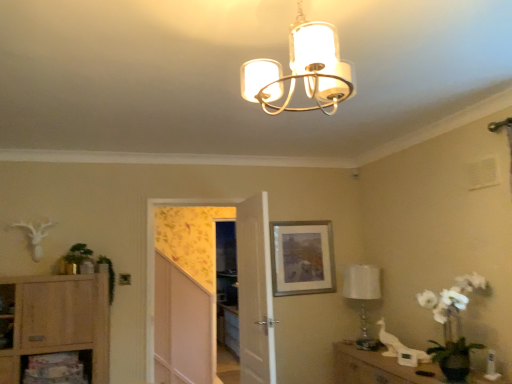
Locate an element on the screen. Image resolution: width=512 pixels, height=384 pixels. white matte chandelier at upper center, which is the 1th lamp from front to back is located at coordinates (302, 70).

At what (x,y) coordinates should I click in order to perform the action: click on transparent glass screen door at center. Please return your answer as a coordinate pair (x, y). This screenshot has height=384, width=512. Looking at the image, I should click on (239, 278).

The width and height of the screenshot is (512, 384). What are the coordinates of `green leafy plant at left, the 2th plant in the left-to-right sequence` in the screenshot? It's located at (108, 273).

Where is `green leafy plant at left, the second plant from the right`? green leafy plant at left, the second plant from the right is located at coordinates (78, 254).

The width and height of the screenshot is (512, 384). I want to click on wooden cabinet at lower right, so (x=377, y=368).

Considering the points (97, 258) and (353, 78), which point is behind, point (97, 258) or point (353, 78)?

The point (97, 258) is more distant.

Is the depth of green leafy plant at left, marked as the first plant in a right-to-left arrangement, greater than that of white matte chandelier at upper center, the first lamp from the top?

Yes, it is behind white matte chandelier at upper center, the first lamp from the top.

From the image's perspective, is green leafy plant at left, marked as the first plant in a right-to-left arrangement, positioned above or below white matte chandelier at upper center, the second lamp positioned from the back?

Result: green leafy plant at left, marked as the first plant in a right-to-left arrangement, is situated lower than white matte chandelier at upper center, the second lamp positioned from the back, in the image.

How different are the orientations of green leafy plant at left, marked as the first plant in a right-to-left arrangement, and white matte chandelier at upper center, which is the 1th lamp from front to back, in degrees?

179 degrees.

Consider the image. From the image's perspective, which object appears higher, wooden shelf at lower left or wooden cabinet at lower right?

wooden shelf at lower left, from the image's perspective.

Which is more to the right, wooden shelf at lower left or wooden cabinet at lower right?

wooden cabinet at lower right.

You are a GUI agent. You are given a task and a screenshot of the screen. Output one action in this format:
    pyautogui.click(x=<x>, y=<y>)
    Task: Click on the shelf on the left of wooden cabinet at lower right
    
    Given the screenshot: What is the action you would take?
    pyautogui.click(x=57, y=368)

Find the location of a particular element. This screenshot has height=384, width=512. cabinetry above the wooden shelf at lower left (from the image's perspective) is located at coordinates (59, 320).

Does light wood cabinet at lower left have a lesser height compared to wooden shelf at lower left?

No, light wood cabinet at lower left is not shorter than wooden shelf at lower left.

From a real-world perspective, is light wood cabinet at lower left located higher than wooden shelf at lower left?

Yes, from a real-world perspective, light wood cabinet at lower left is above wooden shelf at lower left.

Considering the positions of objects light wood cabinet at lower left and wooden shelf at lower left in the image provided, who is in front, light wood cabinet at lower left or wooden shelf at lower left?

light wood cabinet at lower left.

Based on the photo, is wooden shelf at lower left far away from light wood cabinet at lower left?

No.

Does wooden shelf at lower left have a larger size compared to light wood cabinet at lower left?

Incorrect, wooden shelf at lower left is not larger than light wood cabinet at lower left.

Is wooden shelf at lower left turned away from light wood cabinet at lower left?

Absolutely, wooden shelf at lower left is directed away from light wood cabinet at lower left.

Based on the photo, from the image's perspective, is white matte chandelier at upper center, the 2th lamp from the bottom, over white wooden door at center?

Yes.

Which point is more forward, (305, 71) or (246, 363)?

The point (305, 71) is closer to the camera.

Is white matte chandelier at upper center, which ranks as the second lamp in right-to-left order, at the left side of white wooden door at center?

In fact, white matte chandelier at upper center, which ranks as the second lamp in right-to-left order, is to the right of white wooden door at center.

The height and width of the screenshot is (384, 512). I want to click on door on the right of transparent glass screen door at center, so click(x=255, y=292).

Is white wooden door at center far from transparent glass screen door at center?

Actually, white wooden door at center and transparent glass screen door at center are a little close together.

Considering the positions of objects white wooden door at center and transparent glass screen door at center in the image provided, who is in front, white wooden door at center or transparent glass screen door at center?

Positioned in front is white wooden door at center.

Can you confirm if white wooden door at center is positioned to the right of transparent glass screen door at center?

Yes.

Can you tell me how much transparent glass screen door at center and green leafy plant at left, which appears as the 1th plant when viewed from the left, differ in facing direction?

The angle between the facing direction of transparent glass screen door at center and the facing direction of green leafy plant at left, which appears as the 1th plant when viewed from the left, is 2.2 degrees.

From the image's perspective, does transparent glass screen door at center appear lower than green leafy plant at left, the second plant from the right?

Yes.

Considering the points (154, 202) and (80, 248), which point is behind, point (154, 202) or point (80, 248)?

The point (154, 202) is more distant.

Is transparent glass screen door at center smaller than green leafy plant at left, the second plant from the right?

No.

Identify the location of the 2nd plant positioned below the white matte chandelier at upper center, the 2th lamp from the bottom (from a real-world perspective). click(108, 273).

Locate an element on the screen. Image resolution: width=512 pixels, height=384 pixels. shelf on the left of wooden cabinet at lower right is located at coordinates (57, 368).

Which object lies further to the anchor point white wooden door at center, white matte chandelier at upper center, the second lamp positioned from the back, or silver/metallic picture frame at center?

Among the two, white matte chandelier at upper center, the second lamp positioned from the back, is located further to white wooden door at center.

From the image, which object appears to be nearer to wooden shelf at lower left, light wood cabinet at lower left or green leafy plant at left, the 2th plant in the left-to-right sequence?

Among the two, light wood cabinet at lower left is located nearer to wooden shelf at lower left.

Which object lies nearer to the anchor point green leafy plant at left, marked as the first plant in a right-to-left arrangement, white glass lamp at right, the 1th lamp when ordered from bottom to top, or transparent glass screen door at center?

transparent glass screen door at center.

When comparing their distances from wooden shelf at lower left, does green leafy plant at left, the second plant from the right, or wooden cabinet at lower right seem further?

The object further to wooden shelf at lower left is wooden cabinet at lower right.

From the image, which object appears to be farther from white matte chandelier at upper center, which is the 1th lamp from front to back, wooden cabinet at lower right or wooden shelf at lower left?

Based on the image, wooden shelf at lower left appears to be further to white matte chandelier at upper center, which is the 1th lamp from front to back.

Considering their positions, is transparent glass screen door at center positioned further to wooden shelf at lower left than green leafy plant at left, marked as the first plant in a right-to-left arrangement?

The object further to wooden shelf at lower left is transparent glass screen door at center.

When comparing their distances from white wooden door at center, does transparent glass screen door at center or silver/metallic picture frame at center seem closer?

The object closer to white wooden door at center is transparent glass screen door at center.

Estimate the real-world distances between objects in this image. Which object is further from white glass lamp at right, the 2th lamp viewed from the front, white matte chandelier at upper center, which ranks as the second lamp in right-to-left order, or white wooden door at center?

white matte chandelier at upper center, which ranks as the second lamp in right-to-left order, lies further to white glass lamp at right, the 2th lamp viewed from the front, than the other object.

Identify the location of vanity between white matte chandelier at upper center, which is the 1th lamp from front to back, and transparent glass screen door at center in the front-back direction. This screenshot has width=512, height=384. (377, 368).

The image size is (512, 384). In order to click on door between green leafy plant at left, which appears as the 1th plant when viewed from the left, and wooden cabinet at lower right, in the horizontal direction in this screenshot , I will do `click(255, 292)`.

Locate an element on the screen. This screenshot has width=512, height=384. plant between green leafy plant at left, the second plant from the right, and white wooden door at center from left to right is located at coordinates (108, 273).

Where is `door positioned between white matte chandelier at upper center, the first lamp from the top, and wooden shelf at lower left from near to far`? door positioned between white matte chandelier at upper center, the first lamp from the top, and wooden shelf at lower left from near to far is located at coordinates (255, 292).